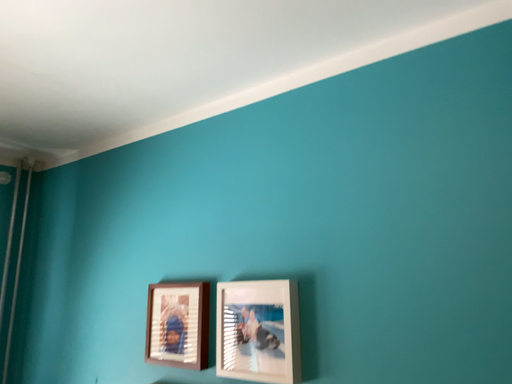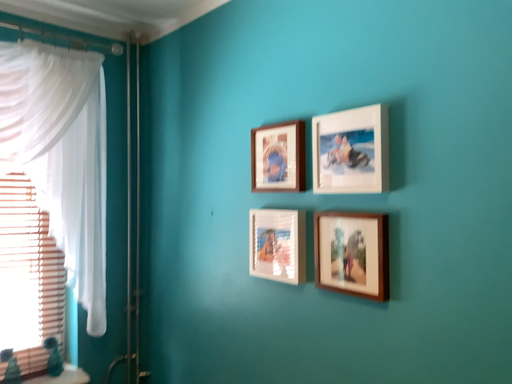
Question: Which way did the camera rotate in the video?

Choices:
 (A) rotated upward
 (B) rotated downward

Answer: (B)